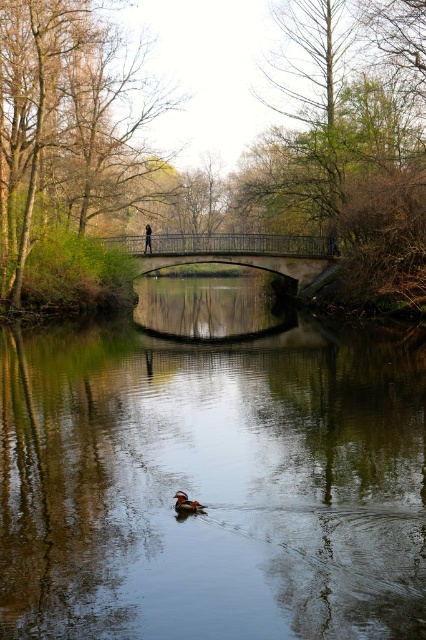
You are standing on the stone bridge at center and want to see your reflection in the smooth reflective water at center. Will your reflection be fully visible in the water?

The smooth reflective water at center is shorter than the stone bridge at center, so your reflection may not be fully visible because the water does not reach the full height of the bridge.

You are a photographer planning to take a photo of the stone bridge at center and the dark blue jeans at center. Since you want to ensure both are clearly visible, which object should you focus on first to account for their sizes?

The stone bridge at center has a larger size compared to dark blue jeans at center, so you should focus on the stone bridge at center first to ensure its details are sharp before adjusting for the smaller dark blue jeans at center.

Based on the photo, you are standing on the bank of the river and want to cross to the other side. The smooth reflective water at center is in your path. If you decide to walk straight ahead, will you step into the water before reaching the bridge?

The smooth reflective water at center is 5.71 meters away from viewer, so if you walk straight ahead, you will step into the water before reaching the bridge since the water is closer than the bridge.